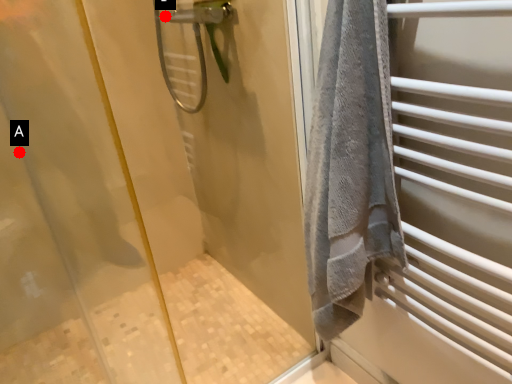
Question: Two points are circled on the image, labeled by A and B beside each circle. Which point is further to the camera?

Choices:
 (A) A is further
 (B) B is further

Answer: (B)